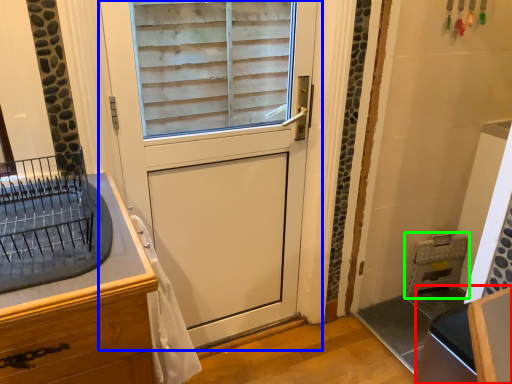
Question: Estimate the real-world distances between objects in this image. Which object is farther from vanity (highlighted by a red box), door (highlighted by a blue box) or appliance (highlighted by a green box)?

Choices:
 (A) door
 (B) appliance

Answer: (B)